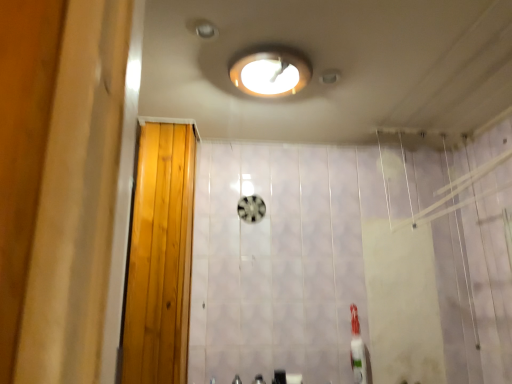
Question: Is white glossy toothbrush at lower right surrounding metallic silver faucet at lower center, the 2th faucet when ordered from right to left?

Choices:
 (A) no
 (B) yes

Answer: (A)

Question: From the image's perspective, is white glossy toothbrush at lower right above metallic silver faucet at lower center, the 2th faucet when ordered from right to left?

Choices:
 (A) yes
 (B) no

Answer: (A)

Question: Is white glossy toothbrush at lower right looking in the opposite direction of metallic silver faucet at lower center, the 2th faucet when ordered from right to left?

Choices:
 (A) no
 (B) yes

Answer: (A)

Question: Does white glossy toothbrush at lower right lie in front of metallic silver faucet at lower center, the 1th faucet positioned from the left?

Choices:
 (A) yes
 (B) no

Answer: (B)

Question: Is white glossy toothbrush at lower right to the right of metallic silver faucet at lower center, the 1th faucet positioned from the left, from the viewer's perspective?

Choices:
 (A) no
 (B) yes

Answer: (B)

Question: In the image, is metallic silver faucet at lower center, the 1th faucet positioned from the left, on the left side or the right side of wooden door at left?

Choices:
 (A) right
 (B) left

Answer: (A)

Question: Is point (233, 379) closer or farther from the camera than point (182, 160)?

Choices:
 (A) farther
 (B) closer

Answer: (B)

Question: In terms of size, does metallic silver faucet at lower center, the 2th faucet when ordered from right to left, appear bigger or smaller than wooden door at left?

Choices:
 (A) small
 (B) big

Answer: (A)

Question: Is metallic silver faucet at lower center, the 1th faucet positioned from the left, situated inside wooden door at left or outside?

Choices:
 (A) outside
 (B) inside

Answer: (A)

Question: Looking at the image, does matte white light fixture at upper center seem bigger or smaller compared to white matte toilet paper at lower center?

Choices:
 (A) big
 (B) small

Answer: (A)

Question: Is matte white light fixture at upper center taller or shorter than white matte toilet paper at lower center?

Choices:
 (A) tall
 (B) short

Answer: (B)

Question: From a real-world perspective, is matte white light fixture at upper center positioned above or below white matte toilet paper at lower center?

Choices:
 (A) below
 (B) above

Answer: (B)

Question: Considering the relative positions of matte white light fixture at upper center and white matte toilet paper at lower center in the image provided, is matte white light fixture at upper center to the left or to the right of white matte toilet paper at lower center?

Choices:
 (A) left
 (B) right

Answer: (A)

Question: From the image's perspective, is metallic silver faucet at lower center, the 1th faucet positioned from the left, above or below satin nickel faucet at lower center, the first faucet viewed from the right?

Choices:
 (A) above
 (B) below

Answer: (B)

Question: Is point (236, 379) positioned closer to the camera than point (257, 377)?

Choices:
 (A) closer
 (B) farther

Answer: (A)